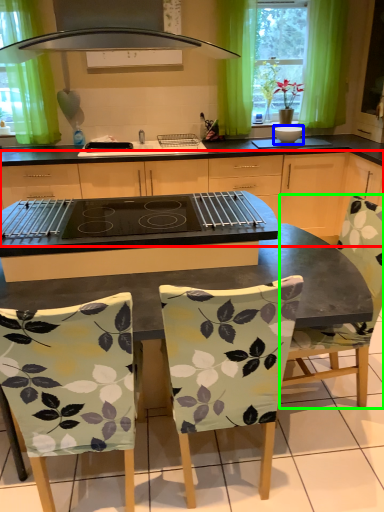
Question: Which object is positioned farthest from cabinetry (highlighted by a red box)? Select from appliance (highlighted by a blue box) and chair (highlighted by a green box).

Choices:
 (A) appliance
 (B) chair

Answer: (B)